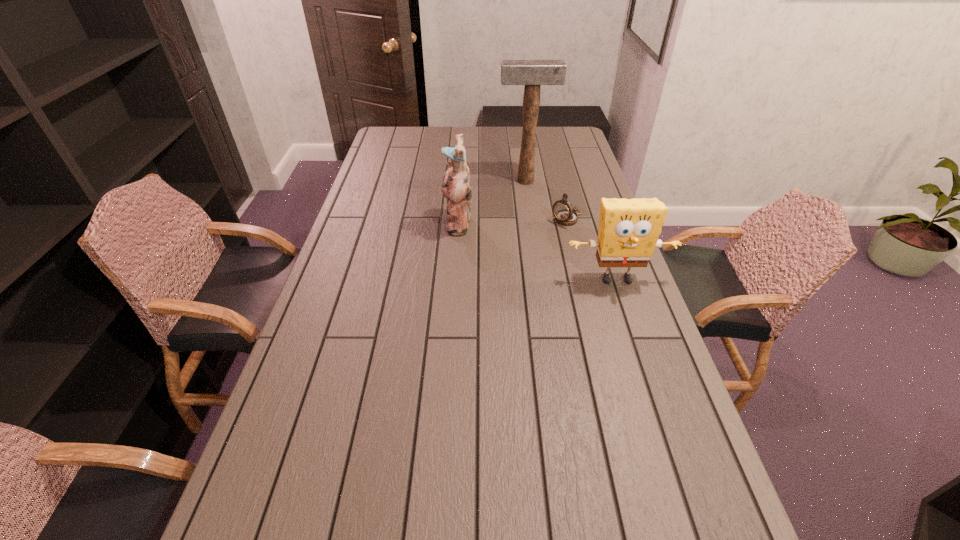
In order to click on vacant area situated 0.340m on the face of the second shortest object in this screenshot , I will do `click(657, 395)`.

In order to click on vacant area situated 0.390m on the striking surface of the tallest object in this screenshot , I will do `click(536, 246)`.

Identify the location of vacant space positioned on the striking surface of the tallest object. Image resolution: width=960 pixels, height=540 pixels. (527, 193).

Locate an element on the screen. This screenshot has width=960, height=540. vacant space located on the striking surface of the tallest object is located at coordinates (529, 203).

Locate an element on the screen. This screenshot has width=960, height=540. free space located 0.360m on the face of the shortest object is located at coordinates (490, 279).

Locate an element on the screen. vacant point located on the face of the shortest object is located at coordinates (507, 266).

At what (x,y) coordinates should I click in order to perform the action: click on vacant space located 0.350m on the face of the shortest object. Please return your answer as a coordinate pair (x, y). This screenshot has width=960, height=540. Looking at the image, I should click on (492, 278).

The width and height of the screenshot is (960, 540). In order to click on sponge that is at the right edge in this screenshot , I will do `click(628, 232)`.

Identify the location of compass positioned at the right edge. The width and height of the screenshot is (960, 540). (564, 214).

The image size is (960, 540). I want to click on vacant space at the far edge of the desktop, so click(x=541, y=134).